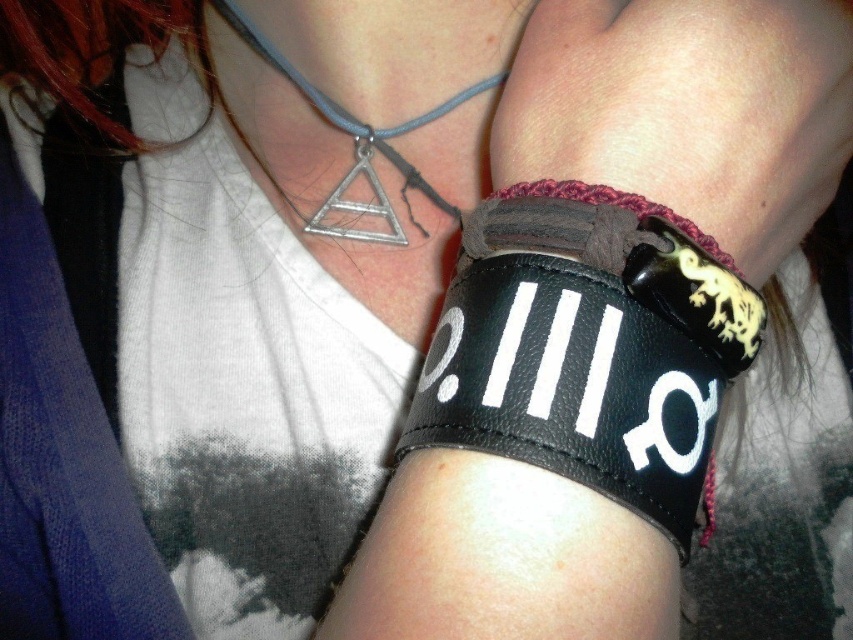
You are a photographer adjusting your camera settings to focus on a specific point in the image. The point you want to focus on is located at coordinates point (682, 184). Given that the camera can only focus on objects within 12 inches from the lens, will this point be in focus?

The distance of point (682, 184) from viewer is 12.66 inches, which is beyond the camera lens focus range of 12 inches. Therefore, the point will not be in focus.

You are a fashion designer analyzing the image. You need to determine which accessory has a smaller height between the black leather bracelet at right and the silver metallic triangle at upper center. Based on the spatial details provided, which one is shorter?

The black leather bracelet at right has a lesser height compared to the silver metallic triangle at upper center, so the black leather bracelet at right is shorter.

You are a fashion designer analyzing the image. You notice a point at coordinates (688,109). Which accessory does this point belong to?

The point at coordinates (688,109) is on the black leather bracelet at right.